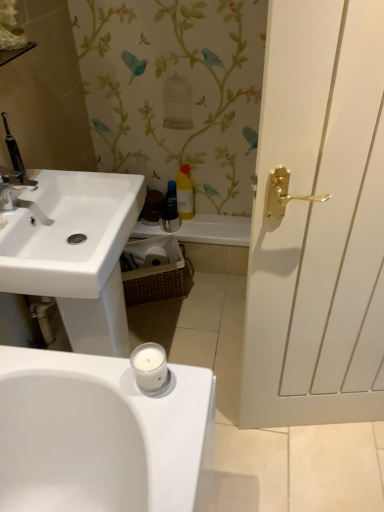
What are the coordinates of `free area below white wood door at right (from a real-world perspective)` in the screenshot? It's located at (325, 431).